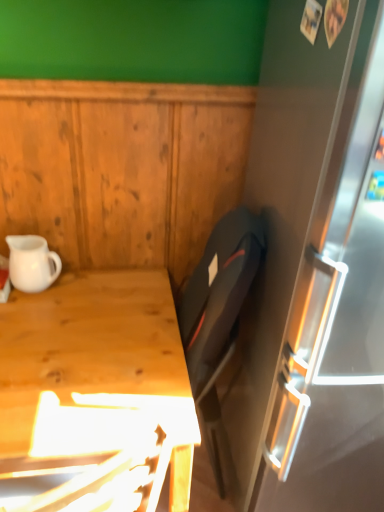
Find the location of a particular element. Image resolution: width=384 pixels, height=512 pixels. free point above light wood desk at lower left (from a real-world perspective) is located at coordinates (84, 347).